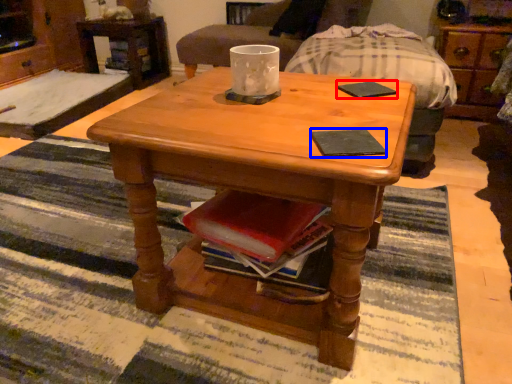
Question: Which point is further to the camera, pad (highlighted by a red box) or pad (highlighted by a blue box)?

Choices:
 (A) pad
 (B) pad

Answer: (A)